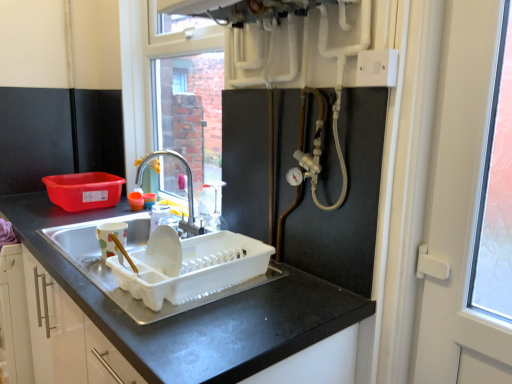
What do you see at coordinates (188, 188) in the screenshot?
I see `brushed metal faucet at center` at bounding box center [188, 188].

Where is `white plastic screen door at right`? This screenshot has height=384, width=512. white plastic screen door at right is located at coordinates (460, 207).

Where is `black matte countertop at center`? black matte countertop at center is located at coordinates (195, 311).

Which point is more forward, (487,366) or (150,294)?

The point (150,294) is in front.

Considering their positions, is white plastic screen door at right located in front of or behind white plastic dish rack at sink, the 1th appliance when ordered from right to left?

Visually, white plastic screen door at right is located in front of white plastic dish rack at sink, the 1th appliance when ordered from right to left.

Is white plastic screen door at right oriented away from white plastic dish rack at sink, which is the second appliance in left-to-right order?

No, white plastic screen door at right's orientation is not away from white plastic dish rack at sink, which is the second appliance in left-to-right order.

Is white plastic electric outlet at upper right inside the boundaries of white plastic screen door at right, or outside?

white plastic electric outlet at upper right is not inside white plastic screen door at right, it's outside.

From the image's perspective, is white plastic electric outlet at upper right positioned above or below white plastic screen door at right?

From the image's perspective, white plastic electric outlet at upper right appears above white plastic screen door at right.

Considering the positions of point (395, 60) and point (481, 351), is point (395, 60) closer or farther from the camera than point (481, 351)?

Point (395, 60) is closer to the camera than point (481, 351).

What are the coordinates of `electric outlet above the white plastic screen door at right (from a real-world perspective)` in the screenshot? It's located at (377, 67).

Is matte ceramic mug at left, arranged as the first appliance when viewed from the left, inside white plastic screen door at right?

That's incorrect, matte ceramic mug at left, arranged as the first appliance when viewed from the left, is not inside white plastic screen door at right.

From the picture: Is white plastic screen door at right at the left side of matte ceramic mug at left, the second appliance when ordered from right to left?

No.

From the image's perspective, does white plastic screen door at right appear higher than matte ceramic mug at left, arranged as the first appliance when viewed from the left?

Indeed, from the image's perspective, white plastic screen door at right is shown above matte ceramic mug at left, arranged as the first appliance when viewed from the left.

Which of these two, white plastic screen door at right or matte ceramic mug at left, the second appliance when ordered from right to left, is bigger?

white plastic screen door at right.

From a real-world perspective, is brushed metal faucet at center physically located above or below white plastic screen door at right?

In terms of real-world spatial position, brushed metal faucet at center is below white plastic screen door at right.

Which is farther, (x=193, y=231) or (x=487, y=334)?

The point (x=193, y=231) is more distant.

Consider the image. Is brushed metal faucet at center oriented away from white plastic screen door at right?

Result: brushed metal faucet at center is not turned away from white plastic screen door at right.

From a real-world perspective, which is physically above, white plastic dish rack at sink, the 1th appliance when ordered from right to left, or white plastic screen door at right?

white plastic screen door at right is physically above.

Is white plastic dish rack at sink, which is the second appliance in left-to-right order, turned away from white plastic screen door at right?

No, white plastic screen door at right is not at the back of white plastic dish rack at sink, which is the second appliance in left-to-right order.

Can you tell me how much white plastic dish rack at sink, which is the second appliance in left-to-right order, and white plastic screen door at right differ in facing direction?

The angular difference between white plastic dish rack at sink, which is the second appliance in left-to-right order, and white plastic screen door at right is 2.32 degrees.

From the image's perspective, which one is positioned higher, white plastic dish rack at sink, the 1th appliance when ordered from right to left, or white plastic screen door at right?

white plastic screen door at right, from the image's perspective.

Is white plastic dish rack at sink, which is the second appliance in left-to-right order, not inside black matte countertop at center?

Yes, white plastic dish rack at sink, which is the second appliance in left-to-right order, is located beyond the bounds of black matte countertop at center.

From a real-world perspective, is white plastic dish rack at sink, which is the second appliance in left-to-right order, physically above black matte countertop at center?

Yes, from a real-world perspective, white plastic dish rack at sink, which is the second appliance in left-to-right order, is above black matte countertop at center.

Between white plastic dish rack at sink, the 1th appliance when ordered from right to left, and black matte countertop at center, which one appears on the left side from the viewer's perspective?

black matte countertop at center is more to the left.

In the scene shown: Does white plastic dish rack at sink, the 1th appliance when ordered from right to left, come behind black matte countertop at center?

Yes, the depth of white plastic dish rack at sink, the 1th appliance when ordered from right to left, is greater than that of black matte countertop at center.

Is white plastic dish rack at sink, which is the second appliance in left-to-right order, aimed at white plastic electric outlet at upper right?

No, white plastic dish rack at sink, which is the second appliance in left-to-right order, does not turn towards white plastic electric outlet at upper right.

From the image's perspective, is white plastic dish rack at sink, the 1th appliance when ordered from right to left, located beneath white plastic electric outlet at upper right?

Yes, from the image's perspective, white plastic dish rack at sink, the 1th appliance when ordered from right to left, is below white plastic electric outlet at upper right.

Can you confirm if white plastic dish rack at sink, the 1th appliance when ordered from right to left, is bigger than white plastic electric outlet at upper right?

Yes.

From a real-world perspective, is white plastic dish rack at sink, which is the second appliance in left-to-right order, physically below white plastic electric outlet at upper right?

Yes, from a real-world perspective, white plastic dish rack at sink, which is the second appliance in left-to-right order, is below white plastic electric outlet at upper right.

Locate an element on the screen. Image resolution: width=512 pixels, height=384 pixels. screen door above the white plastic dish rack at sink, the 1th appliance when ordered from right to left (from a real-world perspective) is located at coordinates (460, 207).

Where is `screen door that appears in front of the white plastic electric outlet at upper right`? Image resolution: width=512 pixels, height=384 pixels. screen door that appears in front of the white plastic electric outlet at upper right is located at coordinates [x=460, y=207].

Looking at this image, looking at the image, which one is located closer to brushed metal faucet at center, white plastic electric outlet at upper right or black matte countertop at center?

black matte countertop at center lies closer to brushed metal faucet at center than the other object.

Looking at the image, which one is located further to white plastic electric outlet at upper right, white plastic screen door at right or white plastic dish rack at sink, which is the second appliance in left-to-right order?

white plastic dish rack at sink, which is the second appliance in left-to-right order, lies further to white plastic electric outlet at upper right than the other object.

Considering their positions, is black matte countertop at center positioned further to white plastic dish rack at sink, which is the second appliance in left-to-right order, than white plastic screen door at right?

Based on the image, white plastic screen door at right appears to be further to white plastic dish rack at sink, which is the second appliance in left-to-right order.

Considering their positions, is white plastic electric outlet at upper right positioned further to white plastic dish rack at sink, the 1th appliance when ordered from right to left, than black matte countertop at center?

Among the two, white plastic electric outlet at upper right is located further to white plastic dish rack at sink, the 1th appliance when ordered from right to left.

Looking at the image, which one is located closer to white plastic electric outlet at upper right, brushed metal faucet at center or white plastic dish rack at sink, the 1th appliance when ordered from right to left?

Among the two, white plastic dish rack at sink, the 1th appliance when ordered from right to left, is located nearer to white plastic electric outlet at upper right.

When comparing their distances from black matte countertop at center, does white plastic dish rack at sink, the 1th appliance when ordered from right to left, or brushed metal faucet at center seem closer?

white plastic dish rack at sink, the 1th appliance when ordered from right to left.

When comparing their distances from matte ceramic mug at left, the second appliance when ordered from right to left, does white plastic screen door at right or brushed metal faucet at center seem further?

Based on the image, white plastic screen door at right appears to be further to matte ceramic mug at left, the second appliance when ordered from right to left.

From the image, which object appears to be farther from white plastic dish rack at sink, the 1th appliance when ordered from right to left, white plastic electric outlet at upper right or brushed metal faucet at center?

white plastic electric outlet at upper right.

You are a GUI agent. You are given a task and a screenshot of the screen. Output one action in this format:
    pyautogui.click(x=<x>, y=<y>)
    Task: Click on the appliance between brushed metal faucet at center and white plastic electric outlet at upper right from left to right
    The image size is (512, 384).
    Given the screenshot: What is the action you would take?
    pyautogui.click(x=190, y=266)

This screenshot has height=384, width=512. I want to click on appliance between matte ceramic mug at left, the second appliance when ordered from right to left, and white plastic electric outlet at upper right, so click(190, 266).

Locate an element on the screen. appliance between black matte countertop at center and matte ceramic mug at left, arranged as the first appliance when viewed from the left, in the front-back direction is located at coordinates (190, 266).

What are the coordinates of `appliance situated between brushed metal faucet at center and white plastic screen door at right from left to right` in the screenshot? It's located at (190, 266).